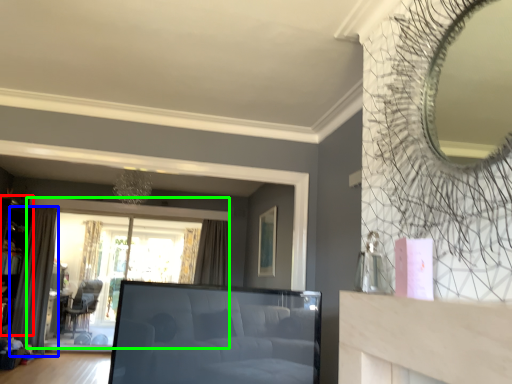
Question: Which object is the closest to the shelf (highlighted by a red box)? Choose among these: curtain (highlighted by a blue box) or window (highlighted by a green box).

Choices:
 (A) curtain
 (B) window

Answer: (A)